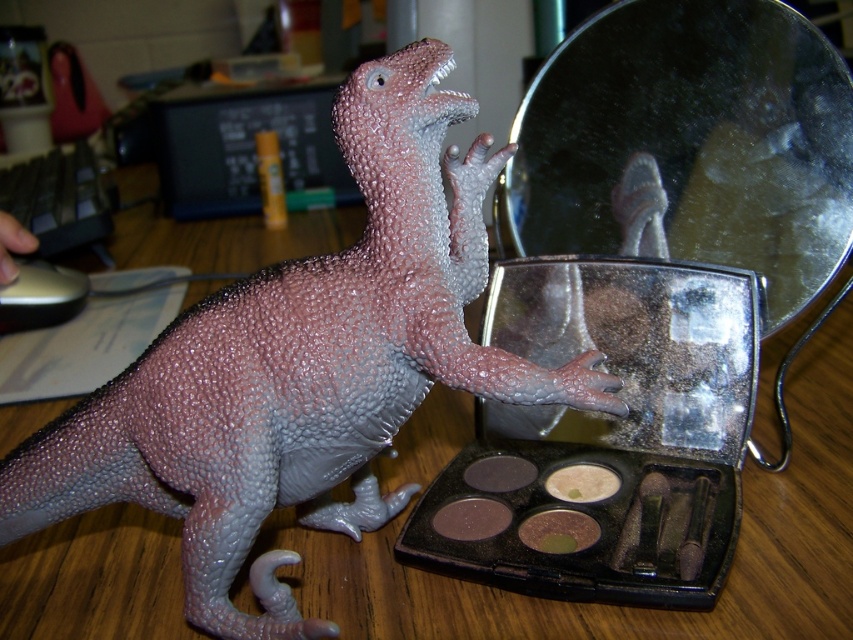
The image size is (853, 640). What do you see at coordinates (693, 140) in the screenshot? I see `metallic reflective mirror at center` at bounding box center [693, 140].

Does point (781, 237) come farther from viewer compared to point (596, 493)?

Yes.

Locate an element on the screen. This screenshot has width=853, height=640. metallic reflective mirror at center is located at coordinates (693, 140).

Is brown matte powder at center to the left of matte brown powder at lower center from the viewer's perspective?

In fact, brown matte powder at center is to the right of matte brown powder at lower center.

Describe the element at coordinates (558, 531) in the screenshot. I see `brown matte powder at center` at that location.

In order to click on brown matte powder at center in this screenshot , I will do `click(558, 531)`.

Does metallic reflective mirror at center appear on the left side of brown matte powder at center?

No, metallic reflective mirror at center is not to the left of brown matte powder at center.

Does metallic reflective mirror at center have a greater width compared to brown matte powder at center?

Yes.

What do you see at coordinates (693, 140) in the screenshot? I see `metallic reflective mirror at center` at bounding box center [693, 140].

Image resolution: width=853 pixels, height=640 pixels. Find the location of `metallic reflective mirror at center`. metallic reflective mirror at center is located at coordinates (693, 140).